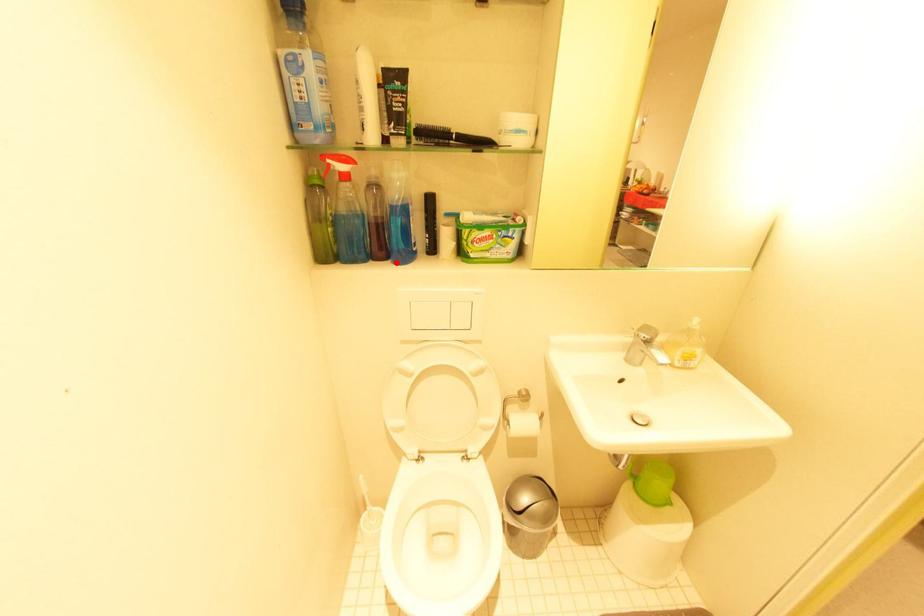
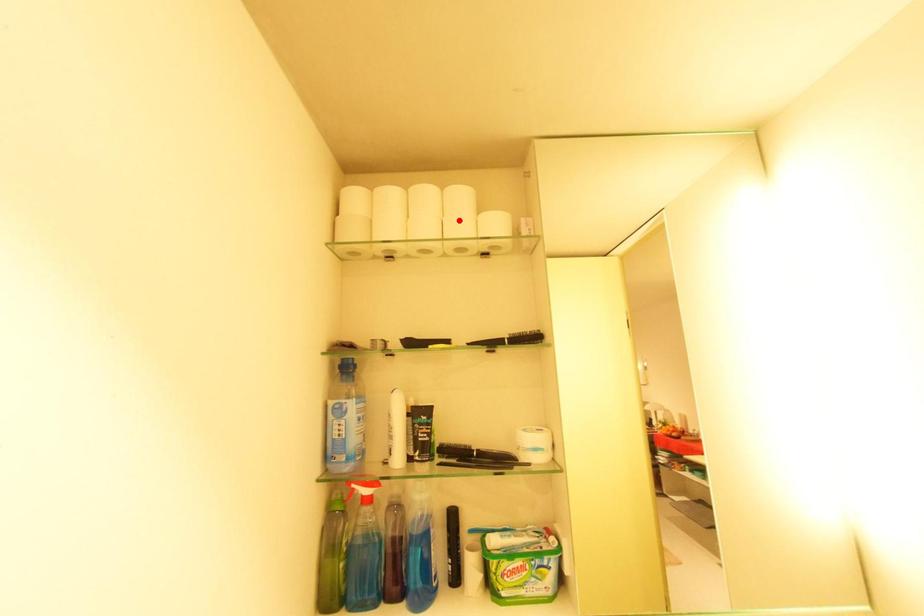
I am providing you with two images of the same scene from different viewpoints. A red point is marked on the first image and another point is marked on the second image. Does the point marked in image1 correspond to the same location as the one in image2?

No